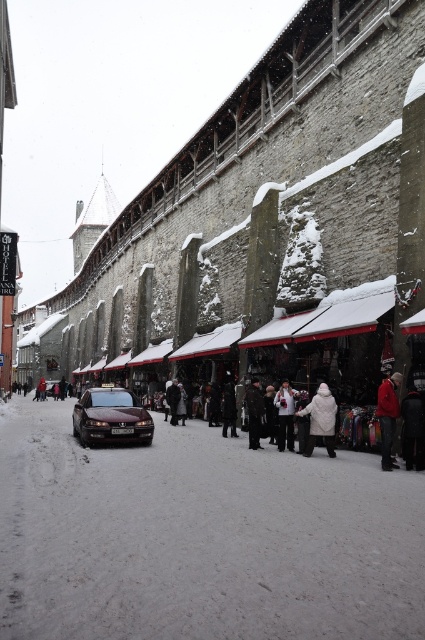
Does white matte coat at center lie behind red woolen jacket at lower right?

Yes, white matte coat at center is further from the viewer.

Between point (311, 417) and point (391, 397), which one is positioned in front?

Positioned in front is point (391, 397).

Which is behind, point (329, 452) or point (387, 420)?

Positioned behind is point (329, 452).

The height and width of the screenshot is (640, 425). I want to click on white matte coat at center, so click(x=320, y=419).

Who is taller, white matte coat at center or white woolen hat at center?

With more height is white woolen hat at center.

Does white matte coat at center appear on the left side of white woolen hat at center?

Incorrect, white matte coat at center is not on the left side of white woolen hat at center.

Between point (328, 433) and point (280, 396), which one is positioned in front?

Point (328, 433)

At what (x,y) coordinates should I click in order to perform the action: click on white matte coat at center. Please return your answer as a coordinate pair (x, y). Image resolution: width=425 pixels, height=640 pixels. Looking at the image, I should click on (320, 419).

Can you confirm if white woolen hat at center is bigger than dark brown fur coat at center?

Actually, white woolen hat at center might be smaller than dark brown fur coat at center.

Does point (289, 433) lie in front of point (249, 385)?

Yes, it is in front of point (249, 385).

Image resolution: width=425 pixels, height=640 pixels. I want to click on white woolen hat at center, so click(x=286, y=413).